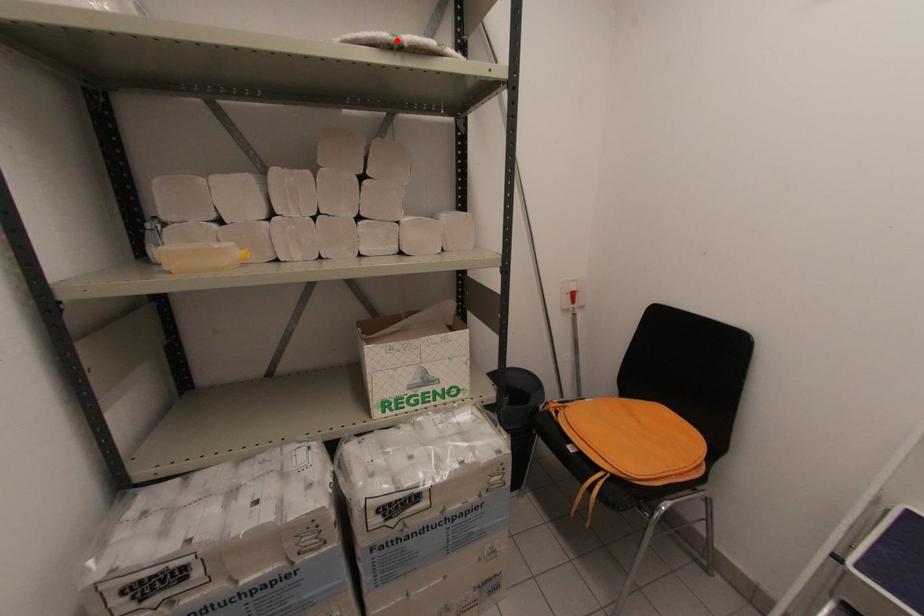
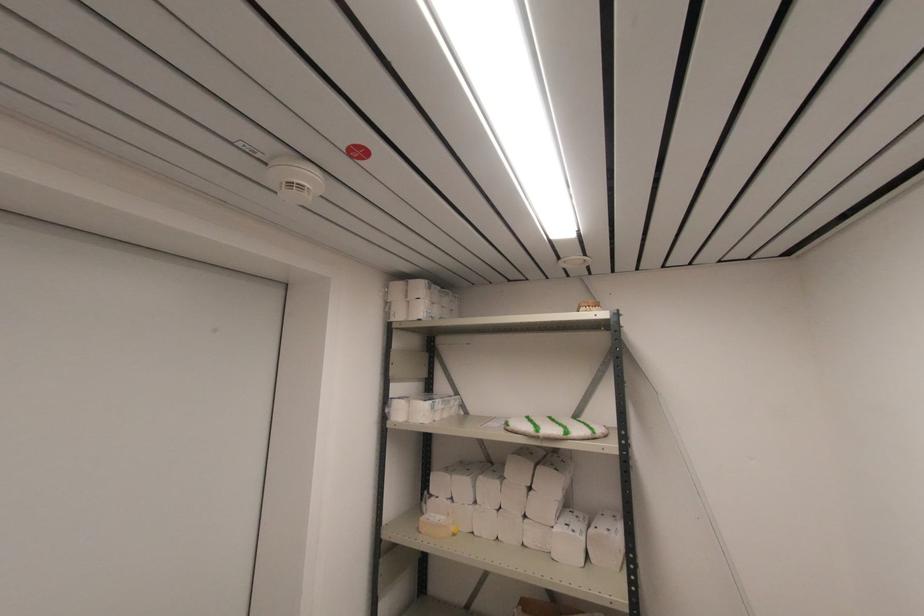
Question: I am providing you with two images of the same scene from different viewpoints. A red point is marked on the first image. Can you still see the location of the red point in image 2?

Choices:
 (A) Yes
 (B) No

Answer: (A)